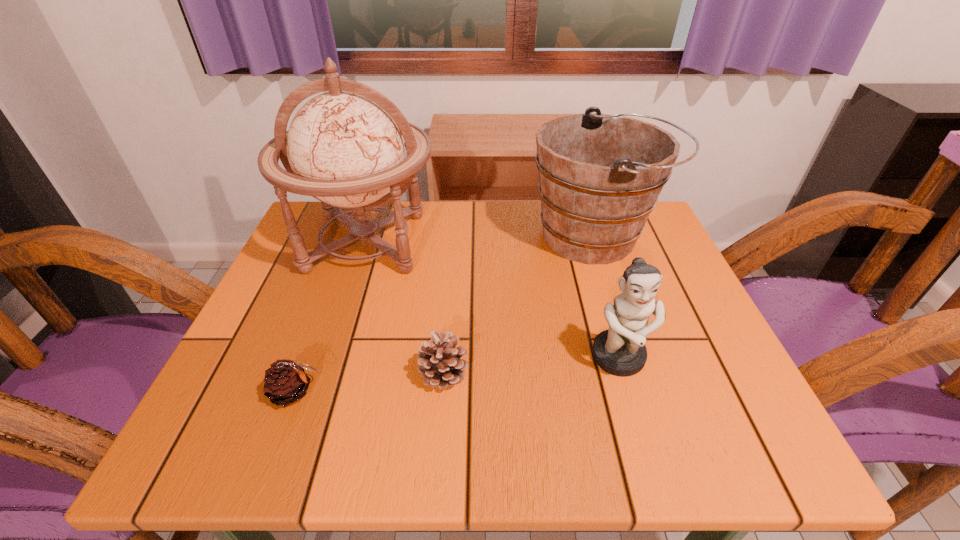
Identify the location of vacant area situated with a leaf charm attached to the left pinecone. (473, 392).

Locate an element on the screen. globe that is at the far edge is located at coordinates (344, 147).

Find the location of a particular element. This screenshot has height=540, width=960. bucket located in the far edge section of the desktop is located at coordinates (600, 175).

Locate an element on the screen. object that is at the near edge is located at coordinates (285, 381).

Where is `globe present at the left edge`? globe present at the left edge is located at coordinates (x=344, y=147).

I want to click on pinecone positioned at the left edge, so click(285, 381).

I want to click on bucket present at the right edge, so click(x=600, y=175).

You are a GUI agent. You are given a task and a screenshot of the screen. Output one action in this format:
    pyautogui.click(x=<x>, y=<y>)
    Task: Click on the figurine that is at the right edge
    The height and width of the screenshot is (540, 960).
    Given the screenshot: What is the action you would take?
    pyautogui.click(x=620, y=351)

Identify the location of object located in the far left corner section of the desktop. Image resolution: width=960 pixels, height=540 pixels. (344, 147).

Where is `object that is at the near left corner`? This screenshot has width=960, height=540. object that is at the near left corner is located at coordinates (285, 381).